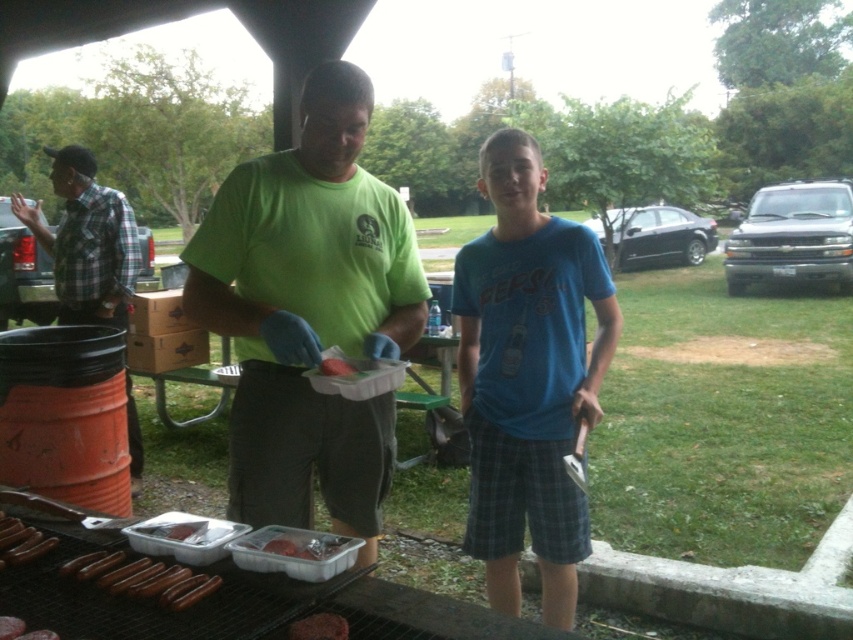
You are a photographer at the park and want to capture a photo of the plaid fabric shirt at left and the shiny brown hot dogs at lower left. From the photographer perspective, which object is positioned more to the left side of the frame?

The plaid fabric shirt at left is positioned more to the left side of the frame than the shiny brown hot dogs at lower left.

You are a photographer trying to capture a wide shot of the picnic scene. You notice the plaid fabric shirt at left and the shiny brown hot dogs at lower left. Which object appears narrower in the photo?

The plaid fabric shirt at left appears narrower than the shiny brown hot dogs at lower left in the photo.